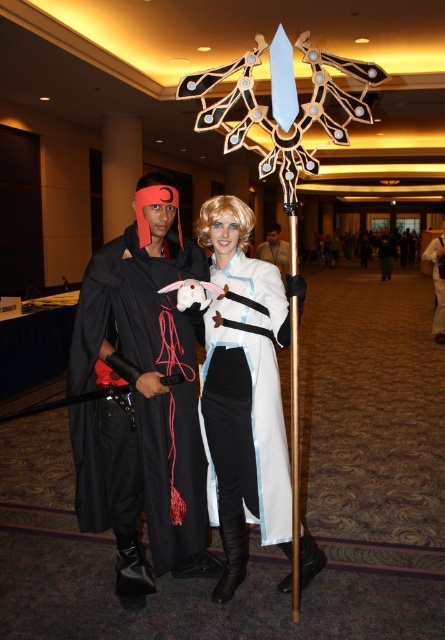
Question: Which of the following is the closest to the observer?

Choices:
 (A) white matte/soft fabric dress at center
 (B) matte black cape at center

Answer: (A)

Question: Which point appears farthest from the camera in this image?

Choices:
 (A) (170, 250)
 (B) (275, 228)
 (C) (440, 252)

Answer: (C)

Question: Is white matte/soft fabric dress at center thinner than matte black cape at center?

Choices:
 (A) yes
 (B) no

Answer: (B)

Question: Does matte black cape at left have a smaller size compared to matte black cape at center?

Choices:
 (A) no
 (B) yes

Answer: (A)

Question: Which of the following is the farthest from the observer?

Choices:
 (A) (280, 266)
 (B) (129, 436)

Answer: (A)

Question: Is white matte/soft fabric dress at center bigger than matte black cape at center?

Choices:
 (A) no
 (B) yes

Answer: (B)